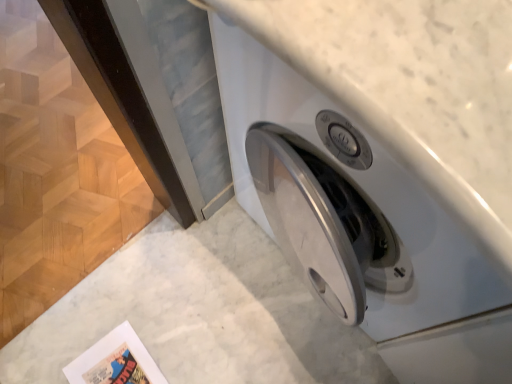
Question: Does point (124, 354) appear closer or farther from the camera than point (492, 279)?

Choices:
 (A) farther
 (B) closer

Answer: (A)

Question: Looking at their shapes, would you say matte paper comic book at lower left is wider or thinner than white glossy washing machine at center?

Choices:
 (A) wide
 (B) thin

Answer: (B)

Question: From a real-world perspective, is matte paper comic book at lower left positioned above or below white glossy washing machine at center?

Choices:
 (A) above
 (B) below

Answer: (B)

Question: In terms of size, does white glossy washing machine at center appear bigger or smaller than matte paper comic book at lower left?

Choices:
 (A) small
 (B) big

Answer: (B)

Question: From a real-world perspective, is white glossy washing machine at center above or below matte paper comic book at lower left?

Choices:
 (A) above
 (B) below

Answer: (A)

Question: From the image's perspective, is white glossy washing machine at center positioned above or below matte paper comic book at lower left?

Choices:
 (A) below
 (B) above

Answer: (B)

Question: Is white glossy washing machine at center to the left or to the right of matte paper comic book at lower left in the image?

Choices:
 (A) right
 (B) left

Answer: (A)